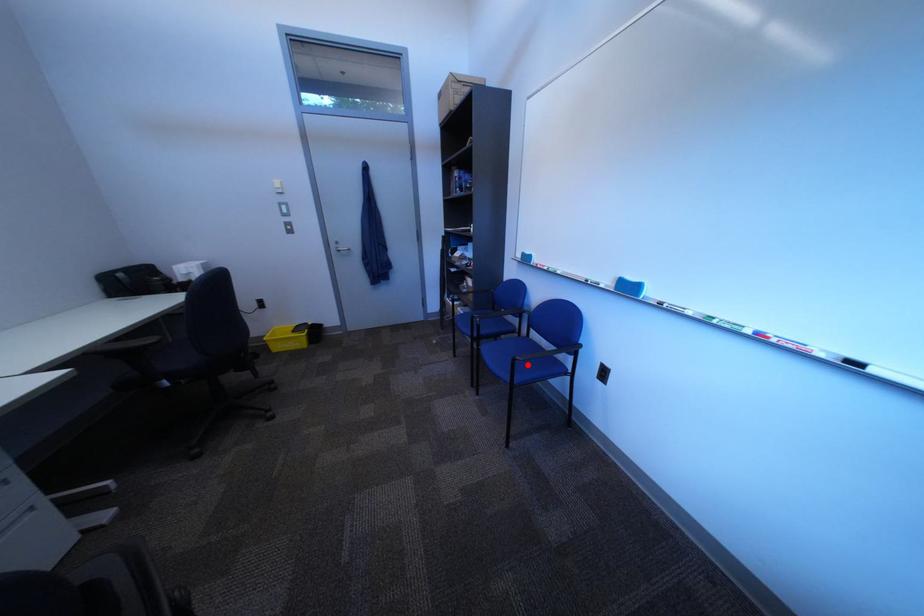
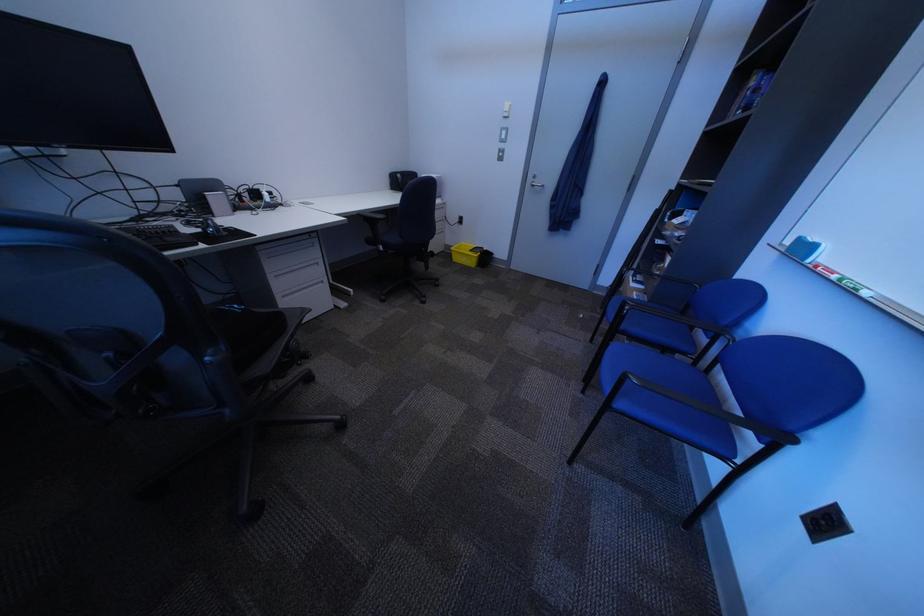
The point at the highlighted location is marked in the first image. Where is the corresponding point in the second image?

(636, 379)